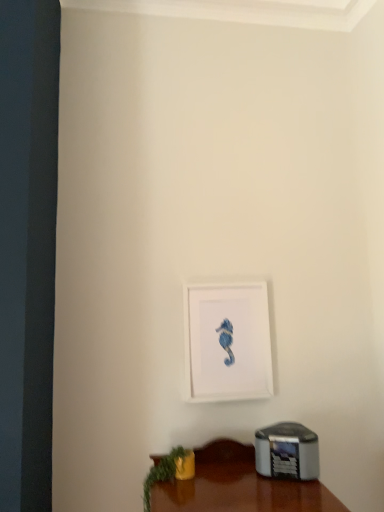
Describe the element at coordinates (161, 473) in the screenshot. This screenshot has height=512, width=384. I see `green leafy plant at lower left` at that location.

Find the location of `green leafy plant at lower left`. green leafy plant at lower left is located at coordinates (161, 473).

In order to face green leafy plant at lower left, should I rotate leftwards or rightwards?

You should rotate left by 3.090 degrees.

What do you see at coordinates (227, 342) in the screenshot? The width and height of the screenshot is (384, 512). I see `white matte picture frame at center` at bounding box center [227, 342].

Where is `white matte picture frame at center`? This screenshot has height=512, width=384. white matte picture frame at center is located at coordinates (227, 342).

In order to face white matte picture frame at center, should I rotate leftwards or rightwards?

Rotate right and turn 4.641 degrees.

Identify the location of green leafy plant at lower left. (161, 473).

Considering the positions of objects white matte picture frame at center and green leafy plant at lower left in the image provided, who is more to the left, white matte picture frame at center or green leafy plant at lower left?

green leafy plant at lower left is more to the left.

Which object is closer to the camera taking this photo, white matte picture frame at center or green leafy plant at lower left?

green leafy plant at lower left.

Which point is more distant from viewer, (239, 371) or (150, 469)?

The point (239, 371) is farther from the camera.

From the image's perspective, which one is positioned higher, white matte picture frame at center or green leafy plant at lower left?

white matte picture frame at center appears higher in the image.

From a real-world perspective, is white matte picture frame at center positioned above or below green leafy plant at lower left?

white matte picture frame at center is situated higher than green leafy plant at lower left in the real world.

Which of these two, white matte picture frame at center or green leafy plant at lower left, is thinner?

With smaller width is white matte picture frame at center.

Considering the sizes of objects white matte picture frame at center and green leafy plant at lower left in the image provided, who is taller, white matte picture frame at center or green leafy plant at lower left?

white matte picture frame at center.

Considering the relative sizes of white matte picture frame at center and green leafy plant at lower left in the image provided, is white matte picture frame at center smaller than green leafy plant at lower left?

Actually, white matte picture frame at center might be larger than green leafy plant at lower left.

Is white matte picture frame at center spatially inside green leafy plant at lower left, or outside of it?

white matte picture frame at center is located beyond the bounds of green leafy plant at lower left.

Can you see white matte picture frame at center touching green leafy plant at lower left?

No, white matte picture frame at center is not beside green leafy plant at lower left.

Could you tell me if white matte picture frame at center is turned towards green leafy plant at lower left?

No.

Can you tell me how much white matte picture frame at center and green leafy plant at lower left differ in facing direction?

There is a 5.29-degree angle between the facing directions of white matte picture frame at center and green leafy plant at lower left.

This screenshot has width=384, height=512. In the image, there is a white matte picture frame at center. What are the coordinates of `plant below it (from the image's perspective)` in the screenshot? It's located at (161, 473).

Considering the relative positions of green leafy plant at lower left and white matte picture frame at center in the image provided, is green leafy plant at lower left to the right of white matte picture frame at center from the viewer's perspective?

No.

Between green leafy plant at lower left and white matte picture frame at center, which one is positioned behind?

white matte picture frame at center is further away from the camera.

Which is closer, (150, 473) or (212, 331)?

The point (150, 473) is in front.

Consider the image. From the image's perspective, between green leafy plant at lower left and white matte picture frame at center, who is located below?

green leafy plant at lower left.

From a real-world perspective, is green leafy plant at lower left under white matte picture frame at center?

Correct, in the physical world, green leafy plant at lower left is lower than white matte picture frame at center.

Which object is wider, green leafy plant at lower left or white matte picture frame at center?

Wider between the two is green leafy plant at lower left.

Who is shorter, green leafy plant at lower left or white matte picture frame at center?

With less height is green leafy plant at lower left.

Is green leafy plant at lower left bigger than white matte picture frame at center?

No.

Would you say green leafy plant at lower left is inside or outside white matte picture frame at center?

green leafy plant at lower left is not enclosed by white matte picture frame at center.

Is green leafy plant at lower left with white matte picture frame at center?

No, green leafy plant at lower left is not next to white matte picture frame at center.

Is white matte picture frame at center at the back of green leafy plant at lower left?

No.

Consider the image. What's the angular difference between green leafy plant at lower left and white matte picture frame at center's facing directions?

5.29 degrees separate the facing orientations of green leafy plant at lower left and white matte picture frame at center.

At what (x,y) coordinates should I click in order to perform the action: click on picture frame on the right side of green leafy plant at lower left. Please return your answer as a coordinate pair (x, y). The width and height of the screenshot is (384, 512). Looking at the image, I should click on (227, 342).

The height and width of the screenshot is (512, 384). In order to click on picture frame that appears above the green leafy plant at lower left (from a real-world perspective) in this screenshot , I will do `click(227, 342)`.

The image size is (384, 512). In order to click on plant below the white matte picture frame at center (from the image's perspective) in this screenshot , I will do `click(161, 473)`.